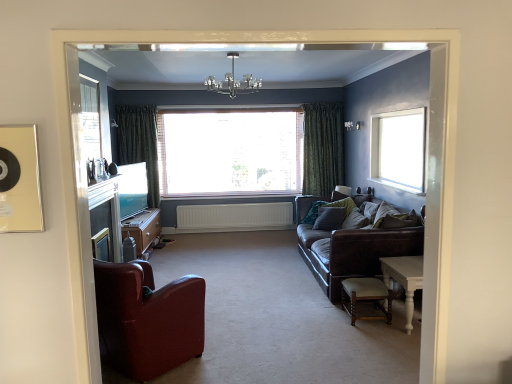
Locate an element on the screen. This screenshot has width=512, height=384. vacant area that lies between light beige leather stool at lower right and leather armchair at left is located at coordinates (272, 340).